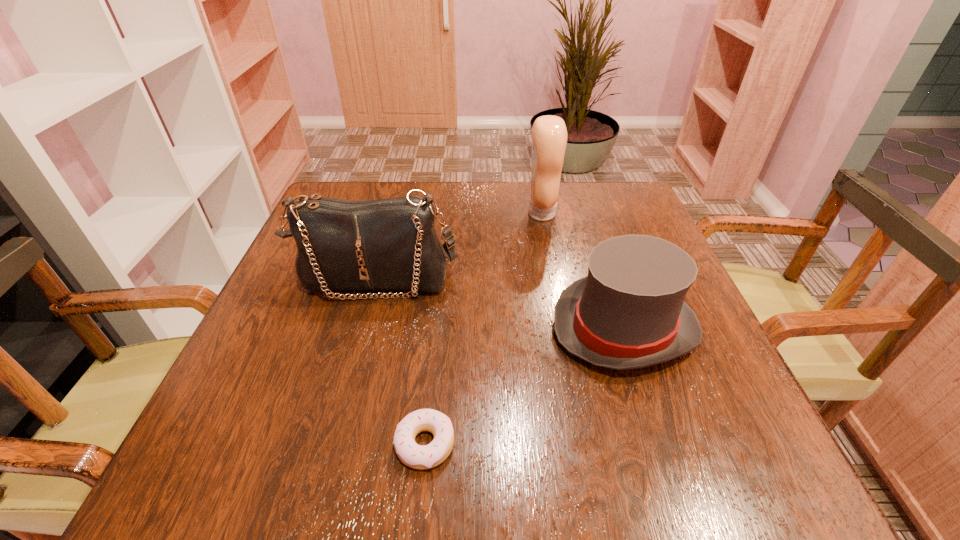
The image size is (960, 540). I want to click on condiment, so point(549,133).

Where is `handbag`? This screenshot has height=540, width=960. handbag is located at coordinates (385, 244).

I want to click on the second shortest object, so click(x=629, y=312).

This screenshot has height=540, width=960. Find the location of `the shortest object`. the shortest object is located at coordinates (421, 457).

This screenshot has width=960, height=540. In order to click on doughnut in this screenshot , I will do `click(421, 457)`.

Locate an element on the screen. This screenshot has height=540, width=960. free spot located 0.250m on the label of the condiment is located at coordinates (428, 213).

Locate an element on the screen. The width and height of the screenshot is (960, 540). free space located on the label of the condiment is located at coordinates (451, 213).

This screenshot has width=960, height=540. What are the coordinates of `free space located 0.130m on the label of the condiment` in the screenshot? It's located at (475, 213).

Image resolution: width=960 pixels, height=540 pixels. What are the coordinates of `vacant space located 0.100m at the front of the handbag with chain and zipper` in the screenshot? It's located at (359, 345).

Identify the location of free space located 0.340m on the left of the dress hat. The width and height of the screenshot is (960, 540). (371, 328).